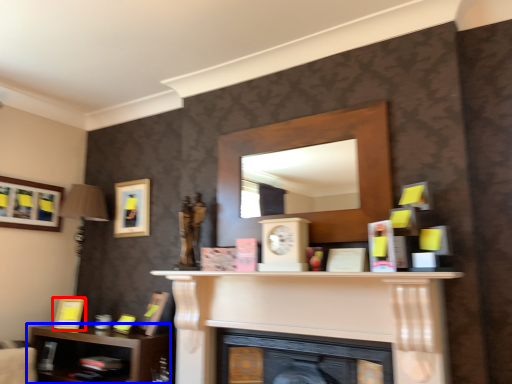
Question: Which object appears closest to the camera in this image, picture frame (highlighted by a red box) or shelf (highlighted by a blue box)?

Choices:
 (A) picture frame
 (B) shelf

Answer: (B)